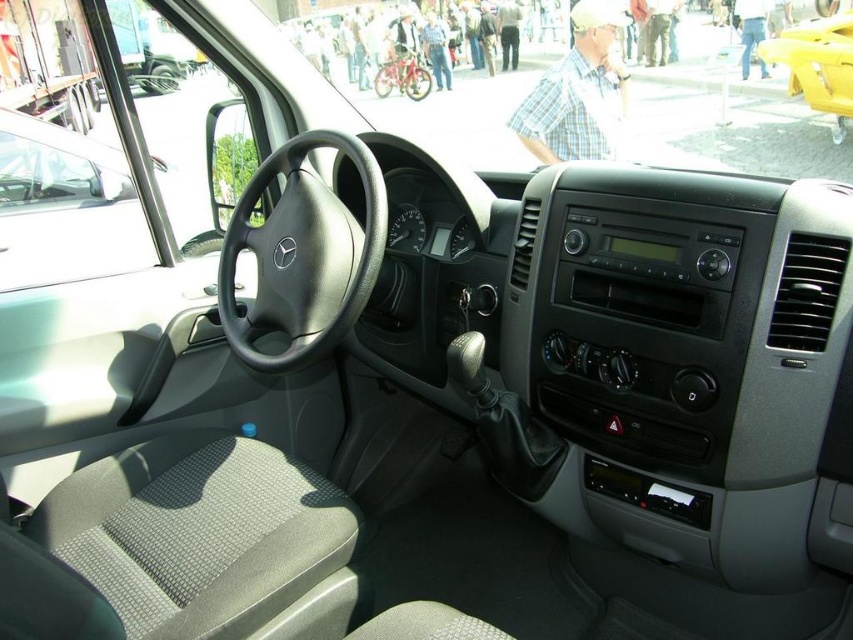
You are a delivery driver who needs to secure a metallic red bicycle at center in the back of your Mercedes van. The black leather steering wheel at center is in your way. Can you lower the steering wheel to make more space?

The black leather steering wheel at center has a lesser height compared to metallic red bicycle at center, so it is already lower than the bicycle. Therefore, lowering it further might not be necessary, but you should check if there is enough space between them.